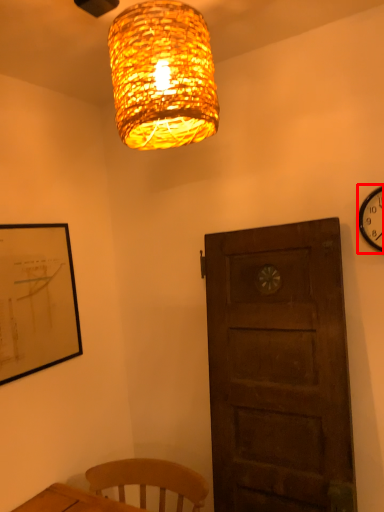
Question: In this image, where is wall clock (annotated by the red box) located relative to lamp?

Choices:
 (A) right
 (B) left

Answer: (A)